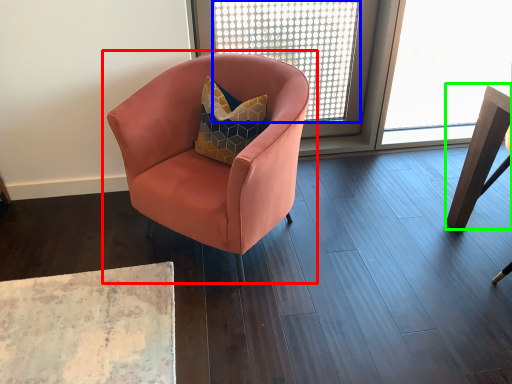
Question: Which object is positioned closest to chair (highlighted by a red box)? Select from window screen (highlighted by a blue box) and table (highlighted by a green box).

Choices:
 (A) window screen
 (B) table

Answer: (B)